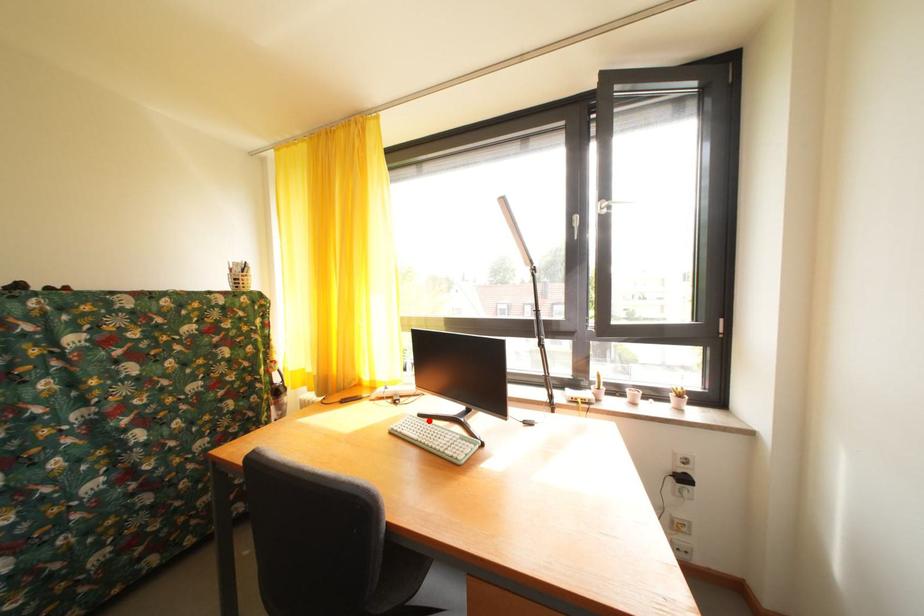
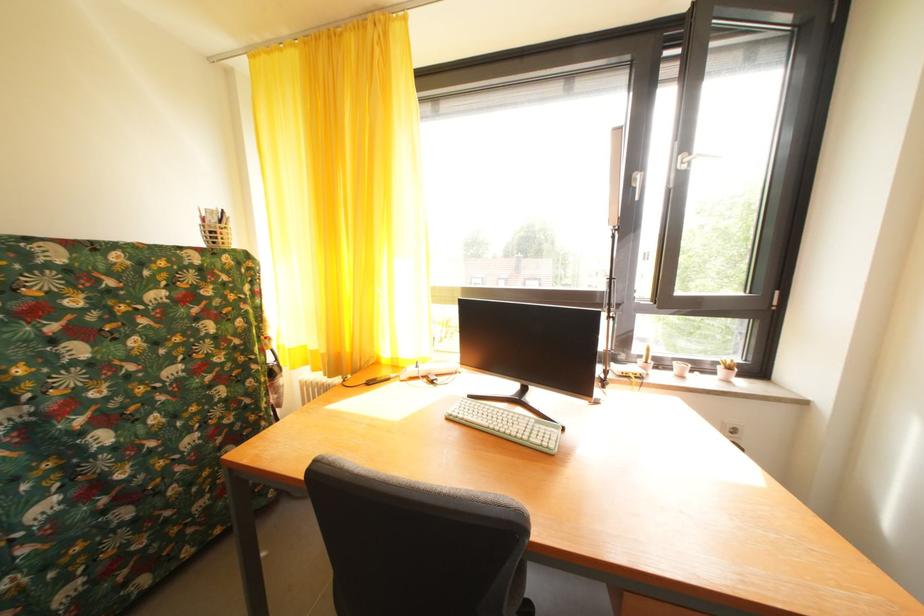
Find the pixel in the second image that matches the highlighted location in the first image.

(479, 402)